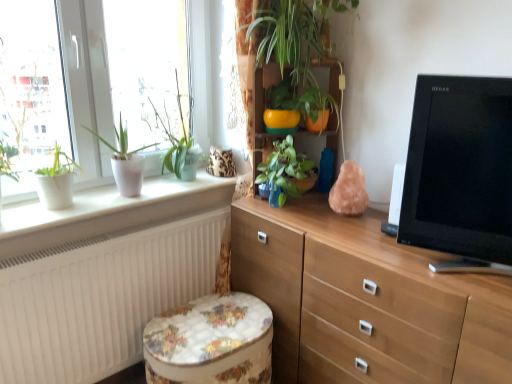
Question: Is floral fabric ottoman at lower center wider or thinner than light brown wood chest of drawers at center?

Choices:
 (A) thin
 (B) wide

Answer: (A)

Question: Looking at the image, does floral fabric ottoman at lower center seem bigger or smaller compared to light brown wood chest of drawers at center?

Choices:
 (A) small
 (B) big

Answer: (A)

Question: Which of these objects is positioned closest to the white glossy window at upper left?

Choices:
 (A) green glossy plant at center, the 3th houseplant positioned from the left
 (B) floral fabric ottoman at lower center
 (C) light brown wood chest of drawers at center
 (D) matte white pot at left, which ranks as the third houseplant in right-to-left order
 (E) clear glass window at upper left

Answer: (E)

Question: Considering the real-world distances, which object is farthest from the light brown wood chest of drawers at center?

Choices:
 (A) clear glass window at upper left
 (B) green glossy plant at center, the 2th houseplant positioned from the right
 (C) white matte radiator at lower left
 (D) black glossy tv at right
 (E) floral fabric ottoman at lower center

Answer: (A)